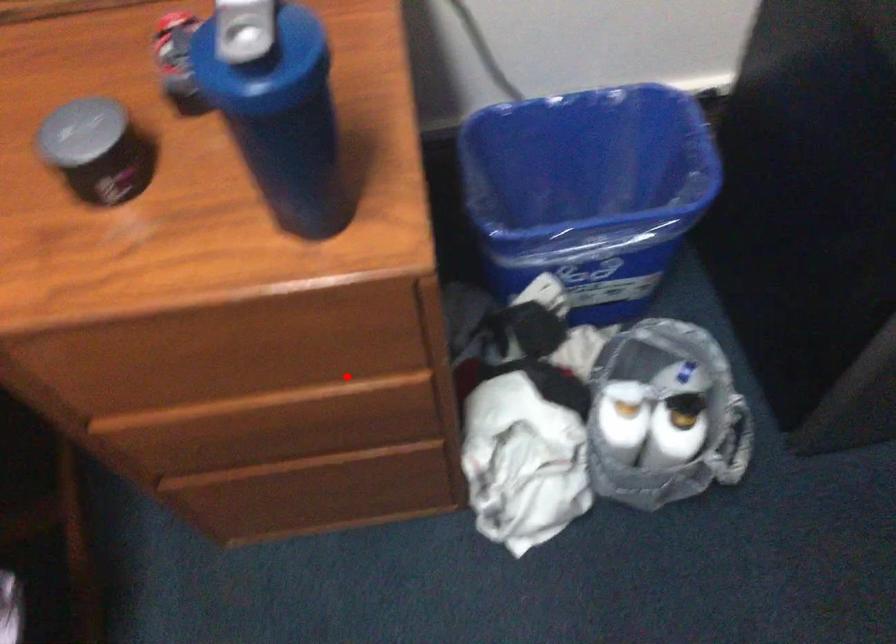
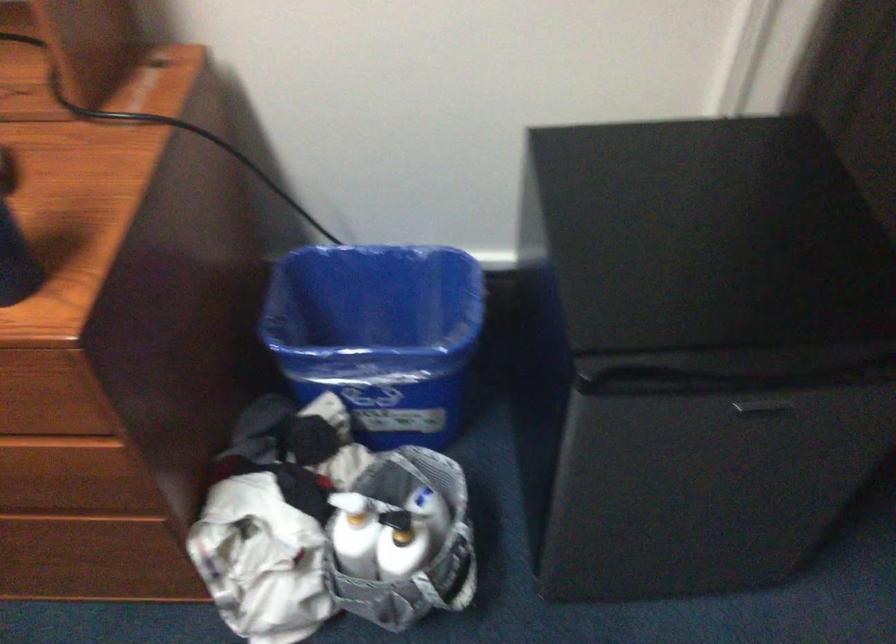
Find the pixel in the second image that matches the highlighted location in the first image.

(56, 433)